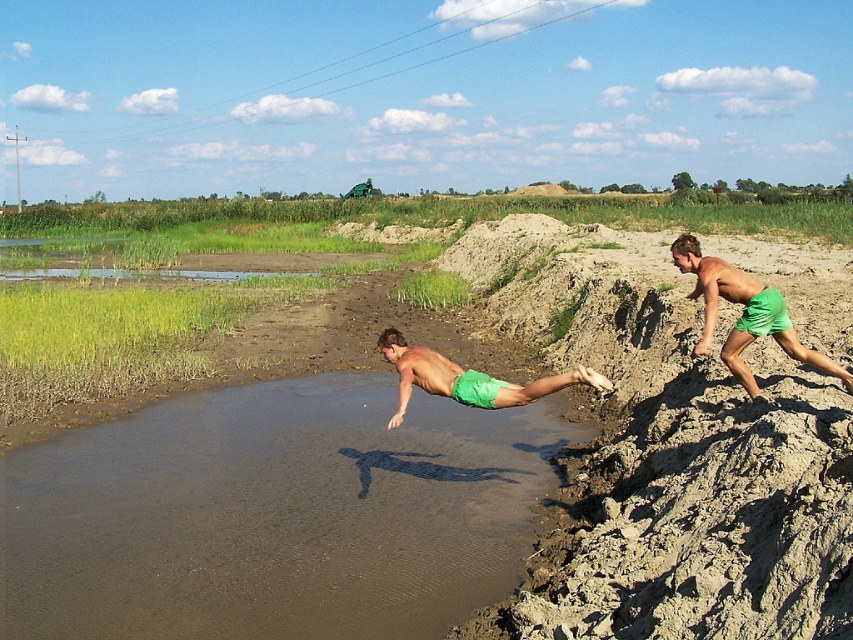
Measure the distance between point (704,346) and camera.

Point (704,346) and camera are 26.15 feet apart from each other.

What do you see at coordinates (743, 314) in the screenshot? The image size is (853, 640). I see `green fabric shorts at right` at bounding box center [743, 314].

Locate an element on the screen. green fabric shorts at right is located at coordinates (743, 314).